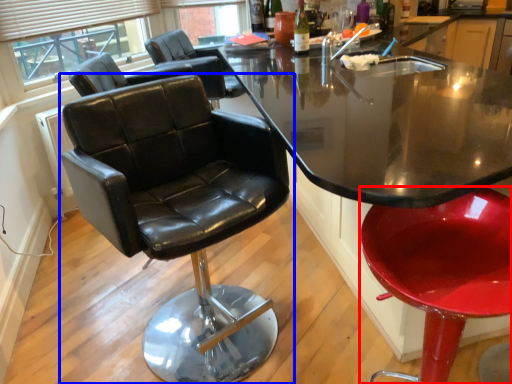
Question: Which object appears closest to the camera in this image, chair (highlighted by a red box) or chair (highlighted by a blue box)?

Choices:
 (A) chair
 (B) chair

Answer: (A)